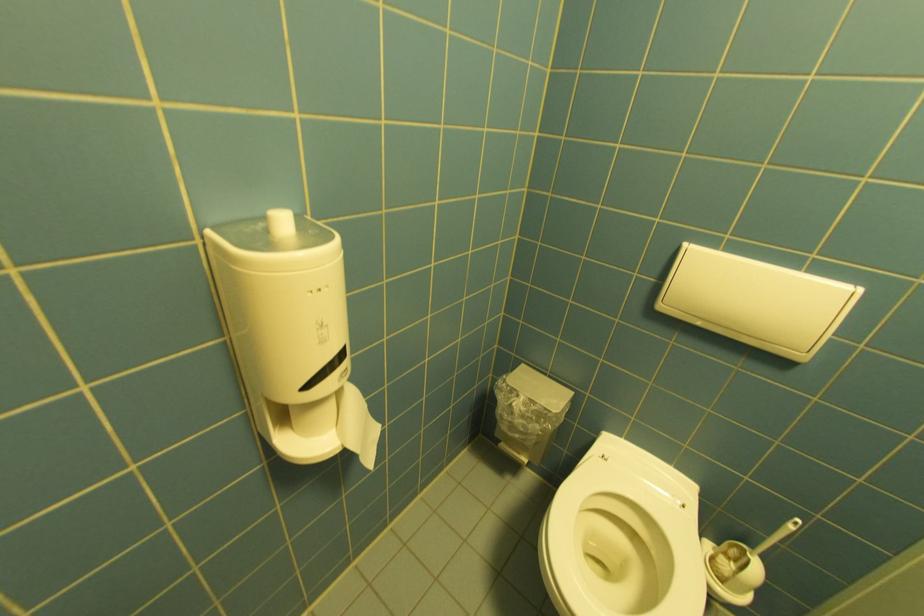
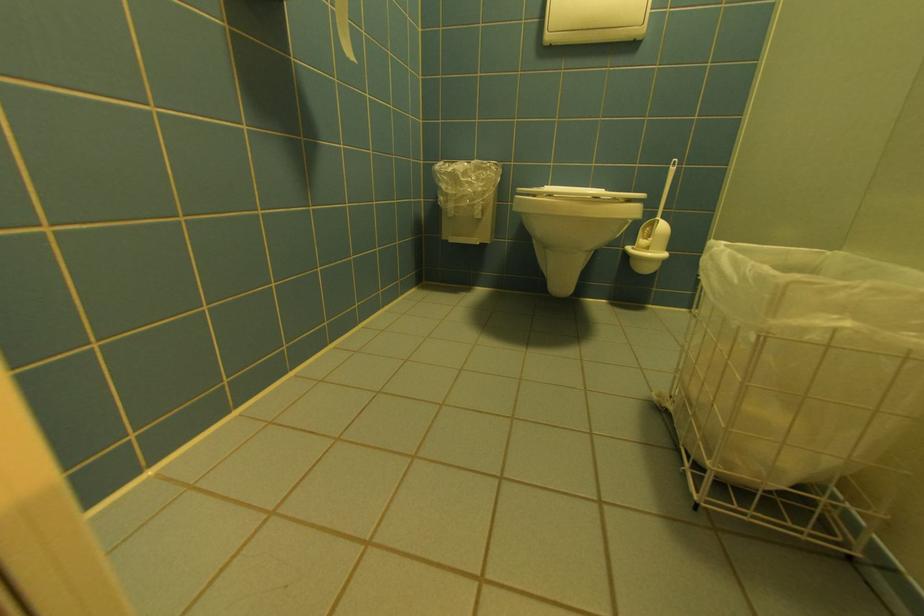
Question: Which direction would the cameraman need to move to produce the second image? Reply with the corresponding letter.

Choices:
 (A) Left
 (B) Right
 (C) Forward
 (D) Backward

Answer: (A)